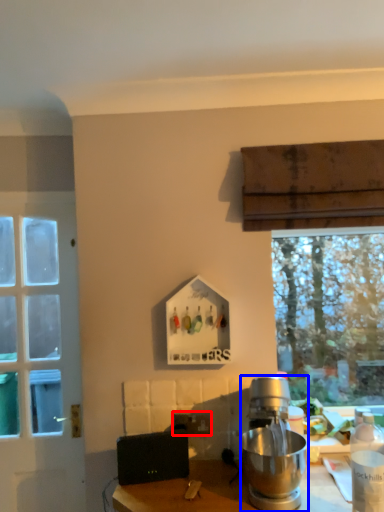
Question: Among these objects, which one is nearest to the camera, power outlet (highlighted by a red box) or kitchen appliance (highlighted by a blue box)?

Choices:
 (A) power outlet
 (B) kitchen appliance

Answer: (B)